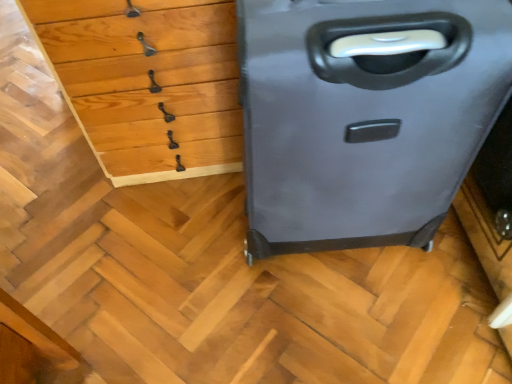
Question: Is wooden chest of drawers at upper left at the left side of matte gray suitcase at right?

Choices:
 (A) yes
 (B) no

Answer: (A)

Question: Does wooden chest of drawers at upper left lie in front of matte gray suitcase at right?

Choices:
 (A) no
 (B) yes

Answer: (A)

Question: Is wooden chest of drawers at upper left with matte gray suitcase at right?

Choices:
 (A) no
 (B) yes

Answer: (A)

Question: Is wooden chest of drawers at upper left taller than matte gray suitcase at right?

Choices:
 (A) no
 (B) yes

Answer: (A)

Question: Is there a large distance between wooden chest of drawers at upper left and matte gray suitcase at right?

Choices:
 (A) yes
 (B) no

Answer: (B)

Question: Is wooden chest of drawers at upper left facing towards matte gray suitcase at right?

Choices:
 (A) no
 (B) yes

Answer: (A)

Question: Is the depth of matte gray suitcase at right greater than that of wooden chest of drawers at upper left?

Choices:
 (A) yes
 (B) no

Answer: (B)

Question: Does matte gray suitcase at right have a lesser height compared to wooden chest of drawers at upper left?

Choices:
 (A) no
 (B) yes

Answer: (A)

Question: Is matte gray suitcase at right to the left of wooden chest of drawers at upper left from the viewer's perspective?

Choices:
 (A) no
 (B) yes

Answer: (A)

Question: Is matte gray suitcase at right outside of wooden chest of drawers at upper left?

Choices:
 (A) no
 (B) yes

Answer: (B)

Question: Is matte gray suitcase at right wider than wooden chest of drawers at upper left?

Choices:
 (A) no
 (B) yes

Answer: (A)

Question: Is matte gray suitcase at right at the right side of wooden chest of drawers at upper left?

Choices:
 (A) yes
 (B) no

Answer: (A)

Question: From the image's perspective, is matte gray suitcase at right above or below wooden chest of drawers at upper left?

Choices:
 (A) below
 (B) above

Answer: (A)